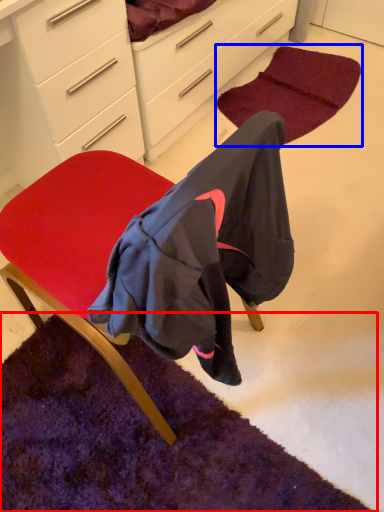
Question: Which point is further to the camera, mat (highlighted by a red box) or mat (highlighted by a blue box)?

Choices:
 (A) mat
 (B) mat

Answer: (B)